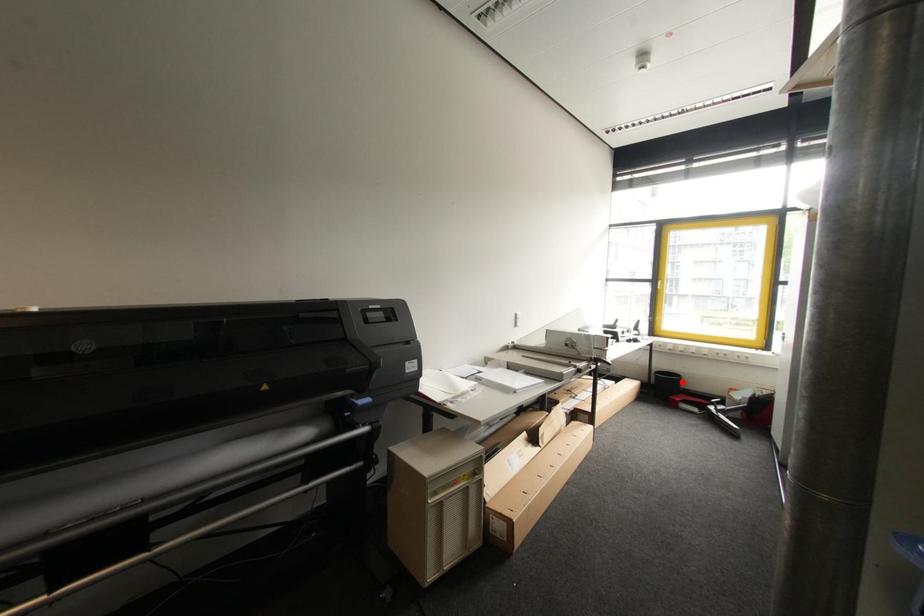
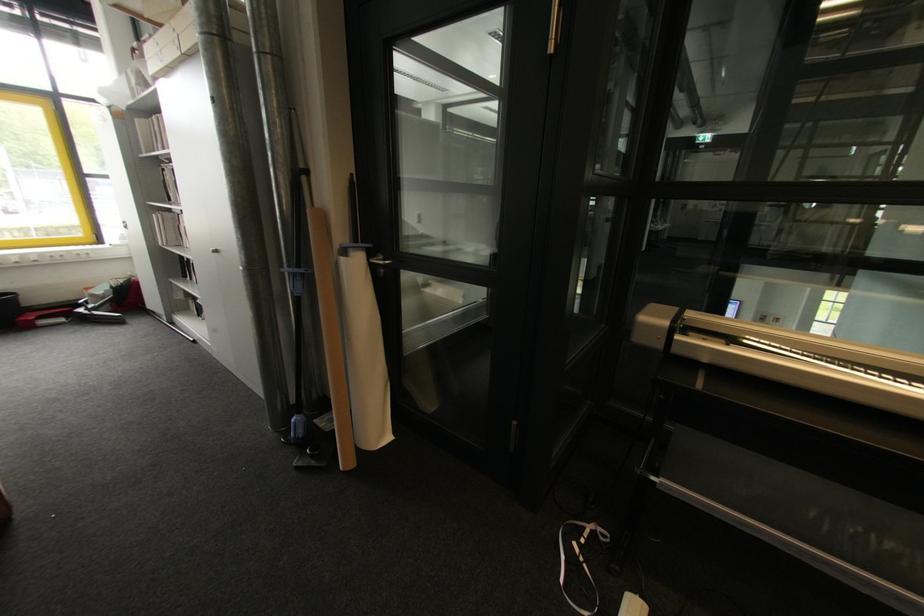
Question: I am providing you with two images of the same scene from different viewpoints. Image1 has a red point marked. In image2, the corresponding 3D location appears at what relative position? Reply with the corresponding letter.

Choices:
 (A) Closer
 (B) Farther

Answer: (B)